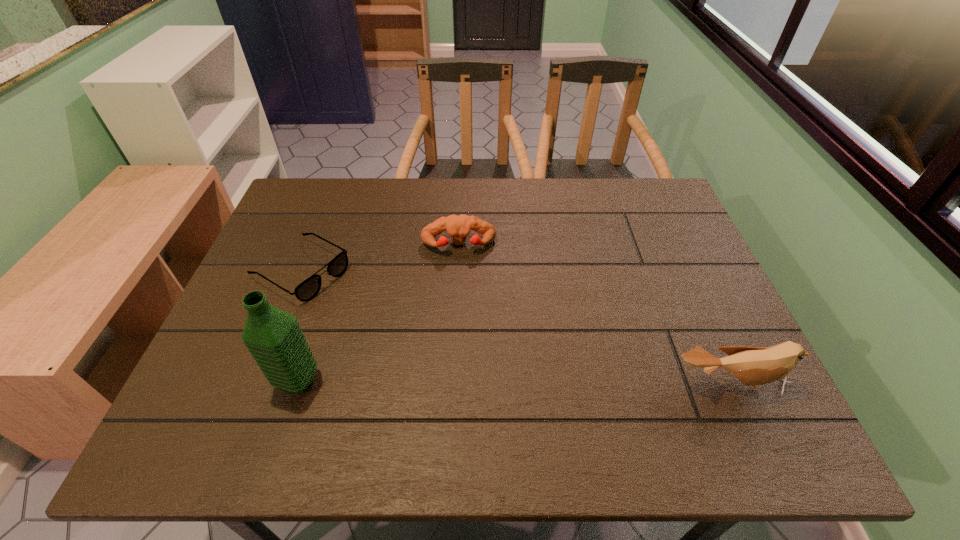
Locate an element on the screen. free space on the desktop that is between the tallest object and the rightmost object and is positioned on the front-facing side of the spectacles is located at coordinates tap(495, 382).

Identify the location of vacant space on the desktop that is between the tallest object and the second tallest object and is positioned with the gloves of the puncher facing forward. (466, 382).